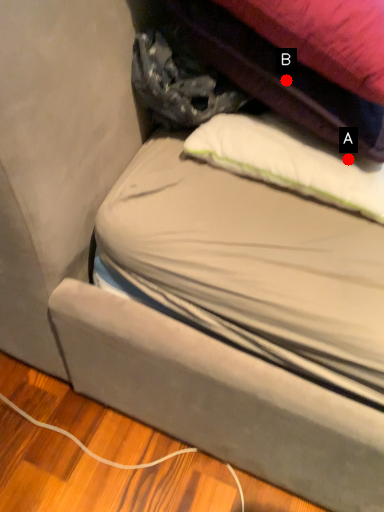
Question: Two points are circled on the image, labeled by A and B beside each circle. Which of the following is the farthest from the observer?

Choices:
 (A) A is further
 (B) B is further

Answer: (A)